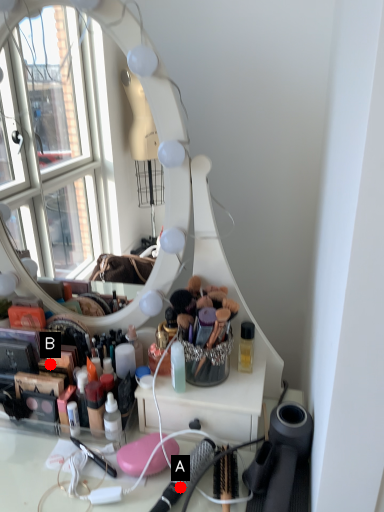
Question: Two points are circled on the image, labeled by A and B beside each circle. Which point appears closest to the camera in this image?

Choices:
 (A) A is closer
 (B) B is closer

Answer: (A)